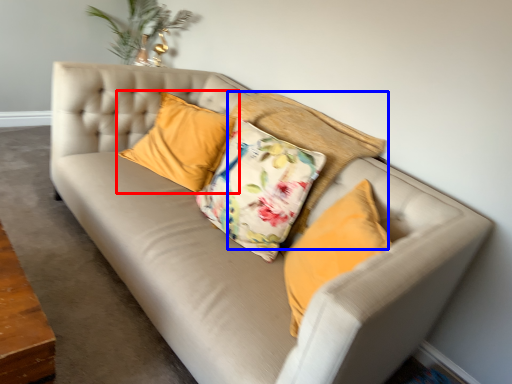
Question: Which of the following is the closest to the observer, pillow (highlighted by a red box) or pillow (highlighted by a blue box)?

Choices:
 (A) pillow
 (B) pillow

Answer: (B)